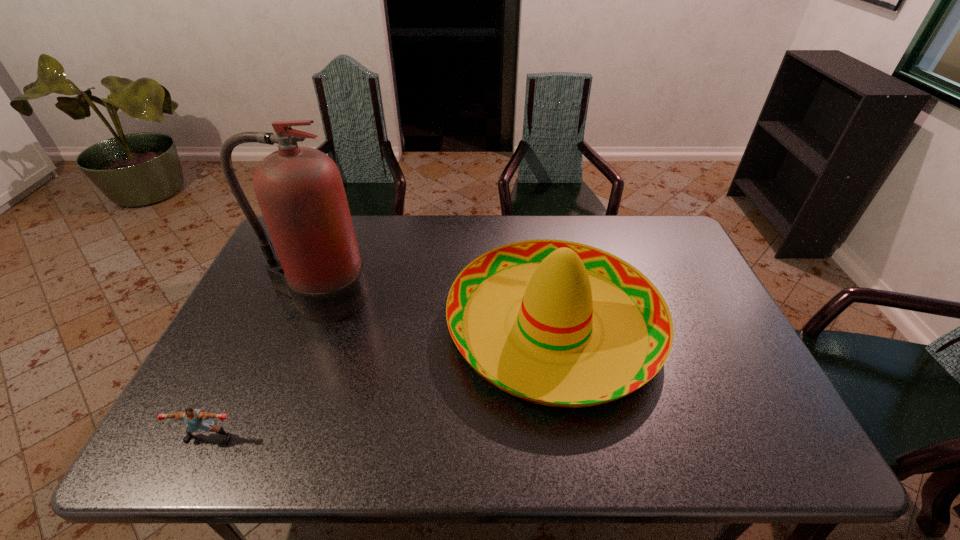
Locate an element on the screen. The image size is (960, 540). free space in the image that satisfies the following two spatial constraints: 1. at the nozzle of the rightmost object; 2. on the right side of the tallest object is located at coordinates (306, 326).

This screenshot has width=960, height=540. In order to click on vacant space that satisfies the following two spatial constraints: 1. at the nozzle of the sombrero; 2. on the right side of the tallest object in this screenshot , I will do `click(306, 326)`.

Image resolution: width=960 pixels, height=540 pixels. Identify the location of vacant area that satisfies the following two spatial constraints: 1. at the nozzle of the fire extinguisher; 2. on the right side of the second shortest object. (306, 326).